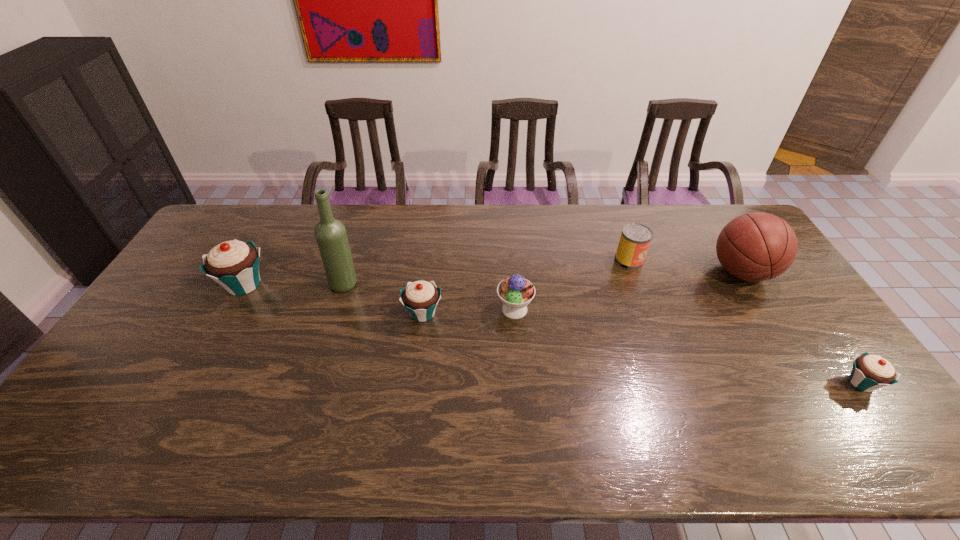
To make them evenly spaced by inserting another cupcake among them, please locate a vacant spot for this new cupcake. Please provide its 2D coordinates. Your answer should be formatted as a tuple, i.e. [(x, y)], where the tuple contains the x and y coordinates of a point satisfying the conditions above.

[(627, 346)]